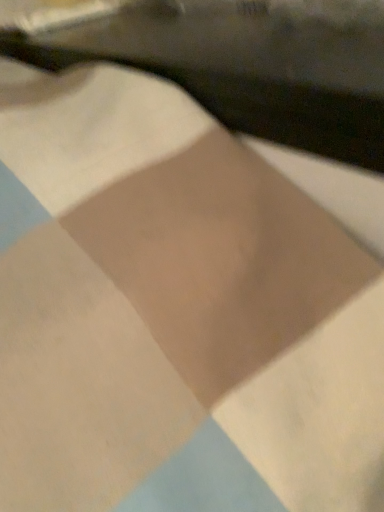
What do you see at coordinates (241, 63) in the screenshot? I see `matte brown knife at center` at bounding box center [241, 63].

The height and width of the screenshot is (512, 384). I want to click on matte brown knife at center, so click(241, 63).

Find the location of a particular element. This screenshot has height=512, width=384. matte brown knife at center is located at coordinates (241, 63).